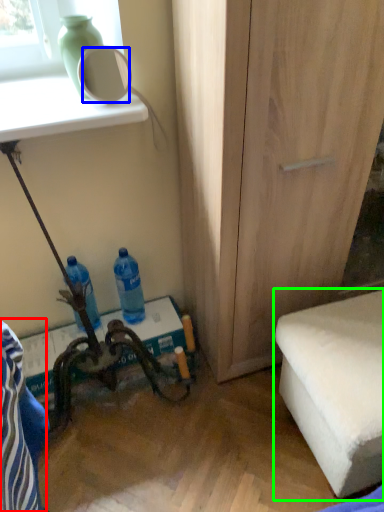
Question: Estimate the real-world distances between objects in this image. Which object is closer to swivel chair (highlighted by a red box), mirror (highlighted by a blue box) or furniture (highlighted by a green box)?

Choices:
 (A) mirror
 (B) furniture

Answer: (B)